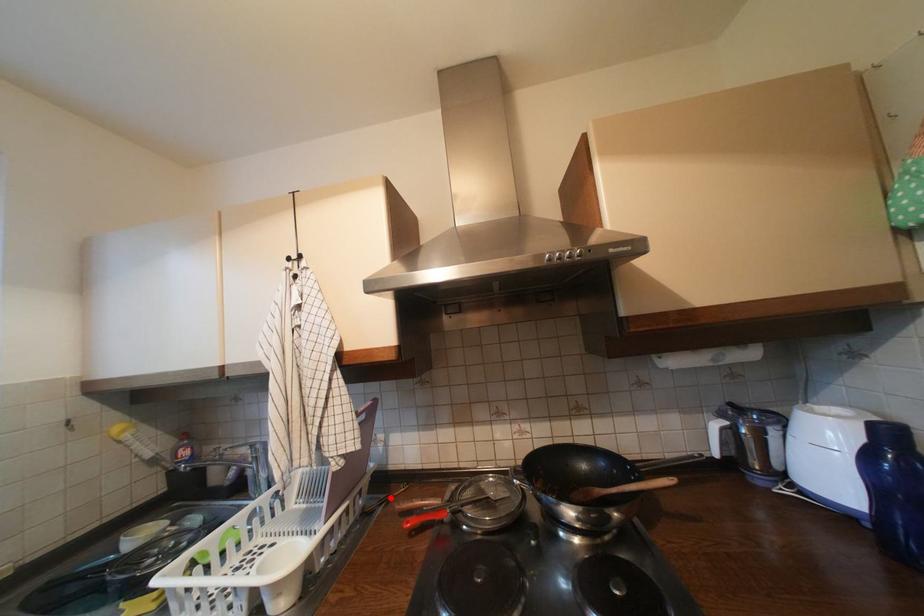
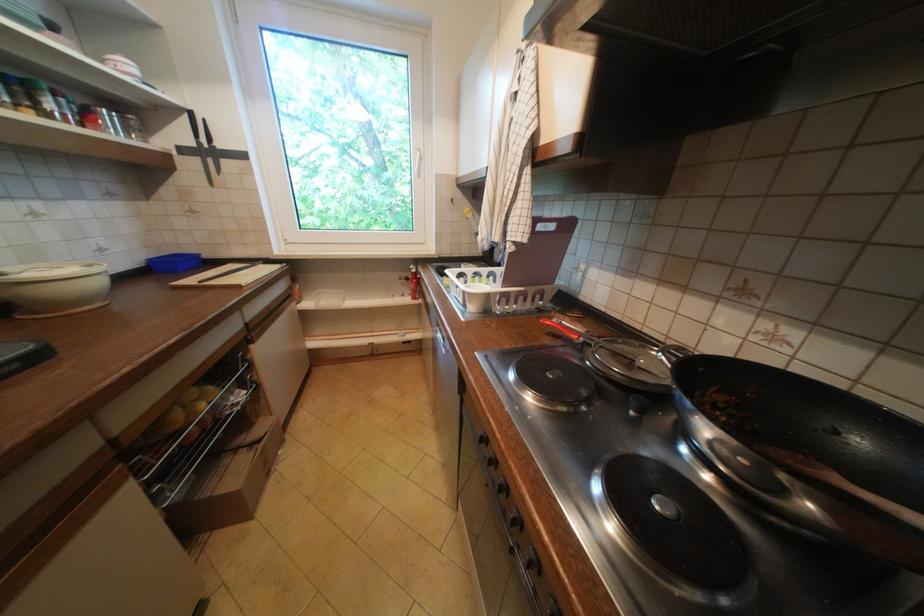
The point at the highlighted location is marked in the first image. Where is the corresponding point in the second image?

(565, 310)